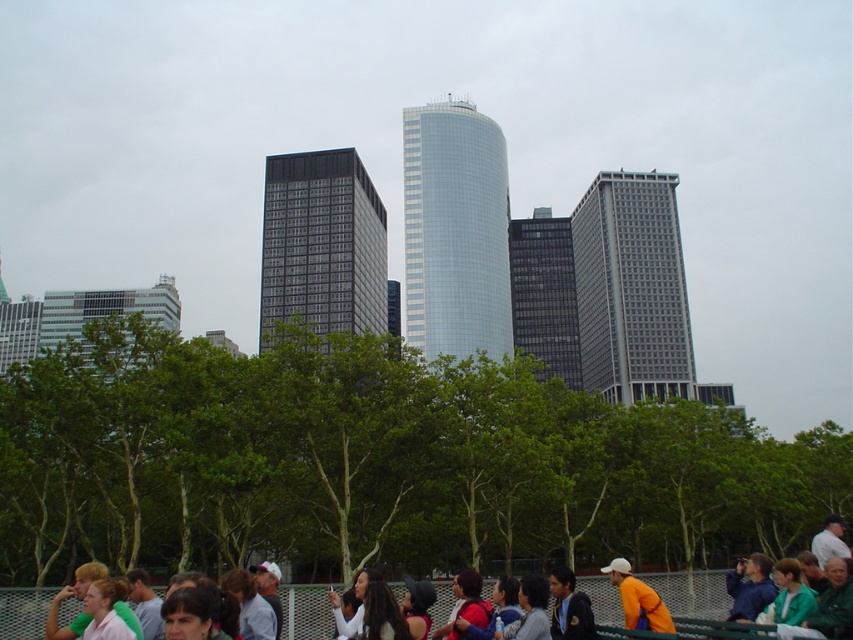
In the scene shown: Between gray glass skyscraper at center and glassy reflective building at left, which one has more height?

Standing taller between the two is gray glass skyscraper at center.

Who is positioned more to the left, gray glass skyscraper at center or glassy reflective building at left?

glassy reflective building at left is more to the left.

Image resolution: width=853 pixels, height=640 pixels. Describe the element at coordinates (631, 289) in the screenshot. I see `gray glass skyscraper at center` at that location.

Identify the location of gray glass skyscraper at center. (631, 289).

Based on the photo, does glassy reflective building at left lie in front of orange fabric at lower right?

That is False.

From the picture: Which is above, glassy reflective building at left or orange fabric at lower right?

glassy reflective building at left

Does point (42, 323) come behind point (640, 604)?

Yes.

Locate an element on the screen. The height and width of the screenshot is (640, 853). glassy reflective building at left is located at coordinates (103, 310).

Can you confirm if shiny glass skyscraper at center is shorter than dark gray glass building at center?

In fact, shiny glass skyscraper at center may be taller than dark gray glass building at center.

Is point (483, 170) farther from camera compared to point (325, 166)?

That is True.

Which is in front, point (418, 275) or point (335, 237)?

Point (418, 275) is more forward.

Where is `shiny glass skyscraper at center`? shiny glass skyscraper at center is located at coordinates (456, 230).